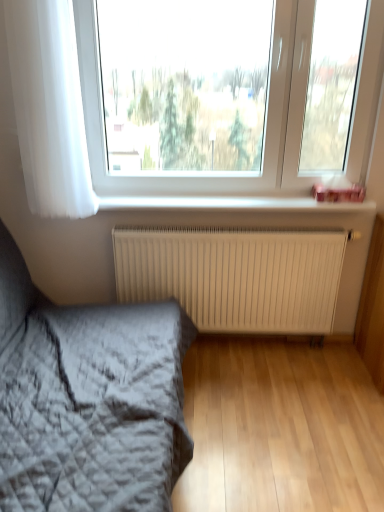
Question: From a real-world perspective, is white matte radiator at center physically located above or below white sheer curtain at left?

Choices:
 (A) above
 (B) below

Answer: (B)

Question: Considering the positions of white matte radiator at center and white sheer curtain at left in the image, is white matte radiator at center bigger or smaller than white sheer curtain at left?

Choices:
 (A) big
 (B) small

Answer: (A)

Question: Which object is the closest to the white matte radiator at center?

Choices:
 (A) white sheer curtain at left
 (B) white plastic window at upper center
 (C) textured gray quilt at lower left
 (D) white plastic window sill at upper center

Answer: (D)

Question: Which of these objects is positioned closest to the white matte radiator at center?

Choices:
 (A) white plastic window at upper center
 (B) white sheer curtain at left
 (C) white plastic window sill at upper center
 (D) textured gray quilt at lower left

Answer: (C)